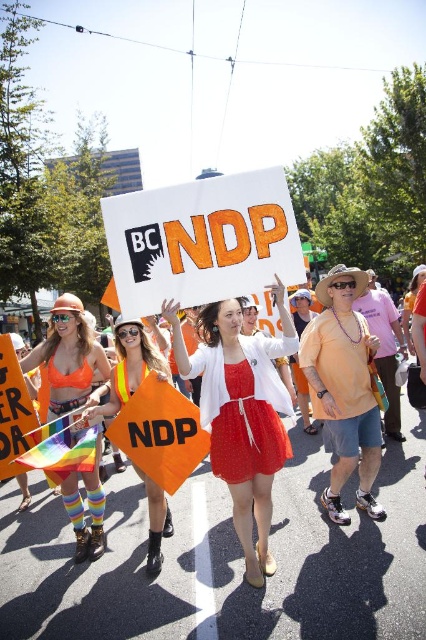
Does white paper sign at center have a greater height compared to matte red dress at center?

Indeed, white paper sign at center has a greater height compared to matte red dress at center.

Based on the photo, is white paper sign at center above matte red dress at center?

Correct, white paper sign at center is located above matte red dress at center.

Is point (221, 186) in front of point (233, 410)?

Yes, point (221, 186) is in front of point (233, 410).

In order to click on white paper sign at center in this screenshot , I will do `click(201, 241)`.

Is orange fabric sign at center positioned at the back of matte white dress at center?

No, it is in front of matte white dress at center.

Between orange fabric sign at center and matte white dress at center, which one appears on the left side from the viewer's perspective?

From the viewer's perspective, orange fabric sign at center appears more on the left side.

Between point (304, 355) and point (212, 310), which one is positioned behind?

Positioned behind is point (304, 355).

The width and height of the screenshot is (426, 640). Identify the location of orange fabric sign at center. (238, 412).

Is orange fabric sign at center thinner than neon orange safety vest at center?

In fact, orange fabric sign at center might be wider than neon orange safety vest at center.

Is point (241, 394) positioned in front of point (157, 353)?

That is True.

Does point (192, 449) come farther from viewer compared to point (161, 561)?

Yes, it is behind point (161, 561).

Where is `orange fabric sign at center`? orange fabric sign at center is located at coordinates (238, 412).